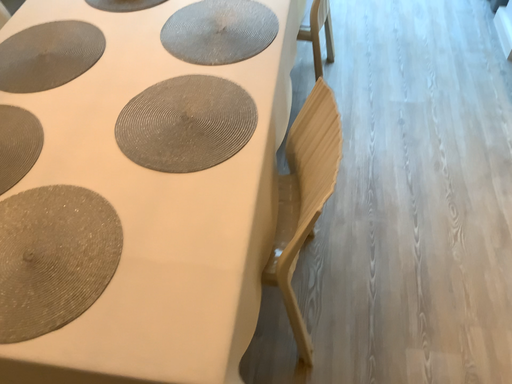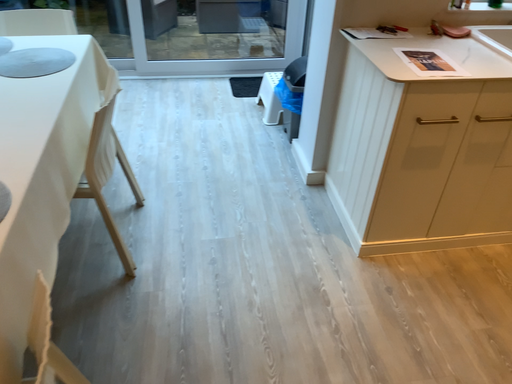
Question: Which way did the camera rotate in the video?

Choices:
 (A) rotated left
 (B) rotated right

Answer: (B)